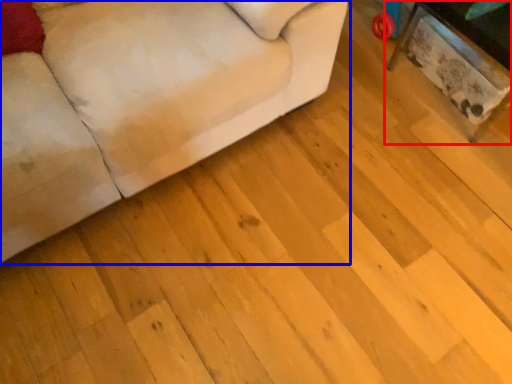
Question: Which object is further to the camera taking this photo, table (highlighted by a red box) or studio couch (highlighted by a blue box)?

Choices:
 (A) table
 (B) studio couch

Answer: (A)